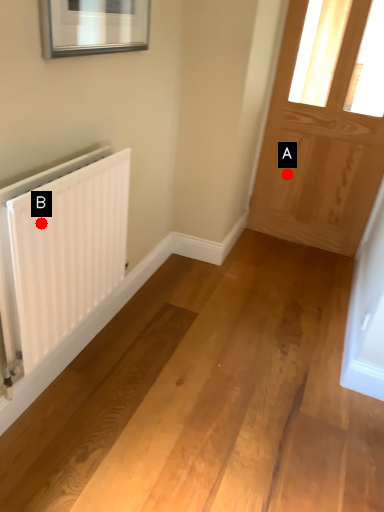
Question: Two points are circled on the image, labeled by A and B beside each circle. Which point is farther to the camera?

Choices:
 (A) A is further
 (B) B is further

Answer: (A)